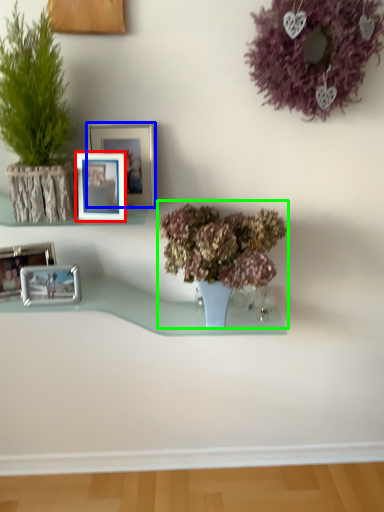
Question: Which object is positioned farthest from picture frame (highlighted by a red box)? Select from picture frame (highlighted by a blue box) and houseplant (highlighted by a green box).

Choices:
 (A) picture frame
 (B) houseplant

Answer: (B)